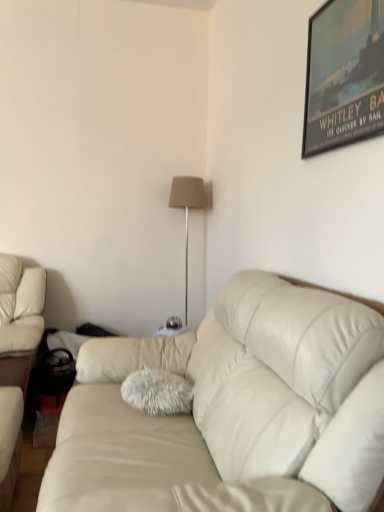
Measure the distance between point [187,287] and camera.

A distance of 3.50 meters exists between point [187,287] and camera.

Measure the distance between point (x=145, y=374) and camera.

Point (x=145, y=374) and camera are 6.22 feet apart from each other.

At what (x,y) coordinates should I click in order to perform the action: click on fuzzy teal throw pillow at center. Please return your answer as a coordinate pair (x, y). The image size is (384, 512). Looking at the image, I should click on (157, 392).

Where is `leather couch at center`? leather couch at center is located at coordinates (233, 410).

Identify the location of metallic poster at upper right. (344, 75).

Consider the image. Considering the relative sizes of beige fabric lampshade at center and fuzzy teal throw pillow at center in the image provided, is beige fabric lampshade at center wider than fuzzy teal throw pillow at center?

No, beige fabric lampshade at center is not wider than fuzzy teal throw pillow at center.

Can you confirm if beige fabric lampshade at center is smaller than fuzzy teal throw pillow at center?

No, beige fabric lampshade at center is not smaller than fuzzy teal throw pillow at center.

Which is nearer, (205, 258) or (155, 410)?

Point (205, 258) is positioned farther from the camera compared to point (155, 410).

In the scene shown: Considering the relative sizes of fuzzy teal throw pillow at center and beige fabric lampshade at center in the image provided, is fuzzy teal throw pillow at center smaller than beige fabric lampshade at center?

Indeed, fuzzy teal throw pillow at center has a smaller size compared to beige fabric lampshade at center.

This screenshot has width=384, height=512. Find the location of `table lamp on the right of fuzzy teal throw pillow at center`. table lamp on the right of fuzzy teal throw pillow at center is located at coordinates (188, 215).

Does fuzzy teal throw pillow at center turn towards beige fabric lampshade at center?

No.

What's the angular difference between fuzzy teal throw pillow at center and beige fabric lampshade at center's facing directions?

The angular difference between fuzzy teal throw pillow at center and beige fabric lampshade at center is 91 degrees.

Considering the points (198, 193) and (352, 24), which point is behind, point (198, 193) or point (352, 24)?

The point (198, 193) is farther from the camera.

Is beige fabric lampshade at center positioned with its back to metallic poster at upper right?

No, metallic poster at upper right is not at the back of beige fabric lampshade at center.

Who is bigger, beige fabric lampshade at center or metallic poster at upper right?

Bigger between the two is beige fabric lampshade at center.

Can you confirm if beige fabric lampshade at center is positioned to the right of leather couch at center?

No.

From the picture: Is beige fabric lampshade at center not close to leather couch at center?

Yes.

From a real-world perspective, is beige fabric lampshade at center physically above leather couch at center?

Correct, in the physical world, beige fabric lampshade at center is higher than leather couch at center.

Is leather couch at center outside of fuzzy teal throw pillow at center?

Yes, leather couch at center is located beyond the bounds of fuzzy teal throw pillow at center.

Does leather couch at center have a smaller size compared to fuzzy teal throw pillow at center?

Actually, leather couch at center might be larger than fuzzy teal throw pillow at center.

Which is in front, leather couch at center or fuzzy teal throw pillow at center?

leather couch at center is closer to the camera.

Does leather couch at center have a lesser height compared to fuzzy teal throw pillow at center?

In fact, leather couch at center may be taller than fuzzy teal throw pillow at center.

Is leather couch at center oriented towards metallic poster at upper right?

No, leather couch at center is not facing towards metallic poster at upper right.

From the picture: From the image's perspective, is leather couch at center above metallic poster at upper right?

No, from the image's perspective, leather couch at center is not on top of metallic poster at upper right.

From the picture: Would you say leather couch at center contains metallic poster at upper right?

That's incorrect, metallic poster at upper right is not inside leather couch at center.

From a real-world perspective, is leather couch at center beneath metallic poster at upper right?

Yes, from a real-world perspective, leather couch at center is under metallic poster at upper right.

From a real-world perspective, who is located higher, metallic poster at upper right or fuzzy teal throw pillow at center?

metallic poster at upper right, from a real-world perspective.

Considering the points (333, 84) and (187, 387), which point is in front, point (333, 84) or point (187, 387)?

Positioned in front is point (333, 84).

In terms of size, does metallic poster at upper right appear bigger or smaller than fuzzy teal throw pillow at center?

In the image, metallic poster at upper right appears to be smaller than fuzzy teal throw pillow at center.

The width and height of the screenshot is (384, 512). I want to click on throw pillow located in front of the beige fabric lampshade at center, so click(157, 392).

You are a GUI agent. You are given a task and a screenshot of the screen. Output one action in this format:
    pyautogui.click(x=<x>, y=<y>)
    Task: Click on the table lamp that appears on the right of fuzzy teal throw pillow at center
    
    Given the screenshot: What is the action you would take?
    coord(188,215)

Estimate the real-world distances between objects in this image. Which object is further from fuzzy teal throw pillow at center, leather couch at center or metallic poster at upper right?

Based on the image, metallic poster at upper right appears to be further to fuzzy teal throw pillow at center.

Based on their spatial positions, is metallic poster at upper right or leather couch at center further from fuzzy teal throw pillow at center?

The object further to fuzzy teal throw pillow at center is metallic poster at upper right.

Looking at the image, which one is located closer to beige fabric lampshade at center, fuzzy teal throw pillow at center or leather couch at center?

Among the two, fuzzy teal throw pillow at center is located nearer to beige fabric lampshade at center.

When comparing their distances from leather couch at center, does fuzzy teal throw pillow at center or beige fabric lampshade at center seem closer?

Among the two, fuzzy teal throw pillow at center is located nearer to leather couch at center.

Looking at the image, which one is located further to fuzzy teal throw pillow at center, metallic poster at upper right or beige fabric lampshade at center?

beige fabric lampshade at center.

Based on their spatial positions, is metallic poster at upper right or fuzzy teal throw pillow at center closer to leather couch at center?

Based on the image, fuzzy teal throw pillow at center appears to be nearer to leather couch at center.

Based on their spatial positions, is leather couch at center or beige fabric lampshade at center further from metallic poster at upper right?

beige fabric lampshade at center is positioned further to the anchor metallic poster at upper right.

When comparing their distances from metallic poster at upper right, does fuzzy teal throw pillow at center or beige fabric lampshade at center seem closer?

Among the two, fuzzy teal throw pillow at center is located nearer to metallic poster at upper right.

You are a GUI agent. You are given a task and a screenshot of the screen. Output one action in this format:
    pyautogui.click(x=<x>, y=<y>)
    Task: Click on the throw pillow located between metallic poster at upper right and beige fabric lampshade at center in the depth direction
    
    Given the screenshot: What is the action you would take?
    pyautogui.click(x=157, y=392)

This screenshot has width=384, height=512. I want to click on throw pillow between leather couch at center and beige fabric lampshade at center from front to back, so click(x=157, y=392).

The height and width of the screenshot is (512, 384). I want to click on picture frame between leather couch at center and beige fabric lampshade at center from front to back, so click(344, 75).

Locate an element on the screen. throw pillow between metallic poster at upper right and leather couch at center from top to bottom is located at coordinates (157, 392).